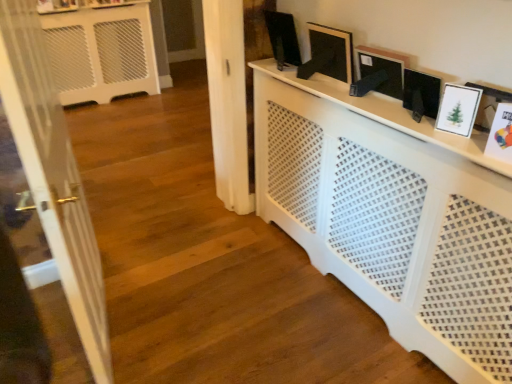
This screenshot has height=384, width=512. Find the location of `vacant area located to the right-hand side of white glossy door at left`. vacant area located to the right-hand side of white glossy door at left is located at coordinates (202, 315).